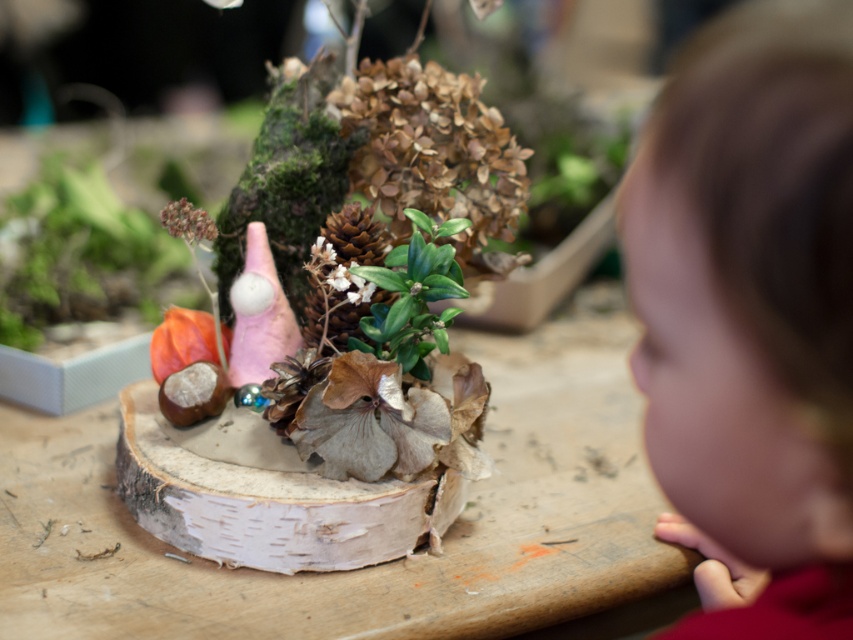
Question: Which point is farther from the camera taking this photo?

Choices:
 (A) (10, 198)
 (B) (439, 321)

Answer: (A)

Question: Which point appears closest to the camera in this image?

Choices:
 (A) (442, 298)
 (B) (329, 253)

Answer: (A)

Question: Is smooth brown hair at right in front of orange matte pumpkin at left?

Choices:
 (A) yes
 (B) no

Answer: (A)

Question: Which of the following is the farthest from the observer?

Choices:
 (A) brown matte pine cone at center
 (B) orange matte pumpkin at left
 (C) green leafy plant at center
 (D) smooth brown hair at right

Answer: (B)

Question: In this image, where is smooth brown hair at right located relative to green leafy plant at center?

Choices:
 (A) right
 (B) left

Answer: (A)

Question: From the image, what is the correct spatial relationship of smooth brown hair at right in relation to orange matte pumpkin at left?

Choices:
 (A) below
 (B) above

Answer: (A)